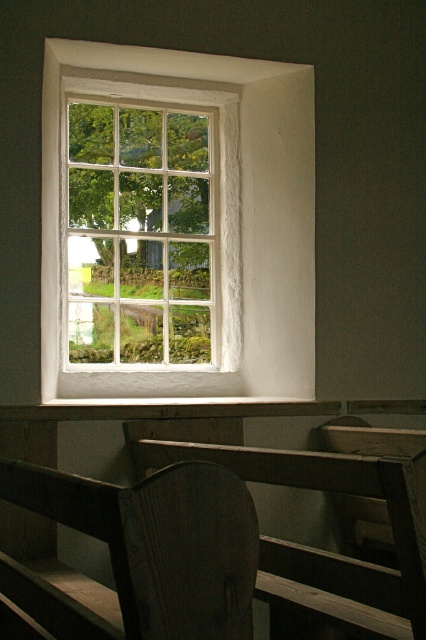
Identify the location of wooden bench at lower left. This screenshot has width=426, height=640. (216, 547).

Which of these two, wooden bench at lower left or white wooden window at center, stands taller?

white wooden window at center is taller.

The height and width of the screenshot is (640, 426). What do you see at coordinates (216, 547) in the screenshot? I see `wooden bench at lower left` at bounding box center [216, 547].

In order to click on wooden bench at lower left in this screenshot , I will do `click(216, 547)`.

Does white textured wood at center appear on the right side of wooden bench at lower left?

Indeed, white textured wood at center is positioned on the right side of wooden bench at lower left.

Identify the location of white textured wood at center. (218, 218).

Consider the image. Is white textured wood at center closer to the viewer compared to white wooden window at center?

Yes, it is.

Does white textured wood at center appear under white wooden window at center?

Yes, white textured wood at center is below white wooden window at center.

Find the location of a particular element. This screenshot has width=426, height=640. white textured wood at center is located at coordinates (218, 218).

Locate an element on the screen. The image size is (426, 640). white textured wood at center is located at coordinates (218, 218).